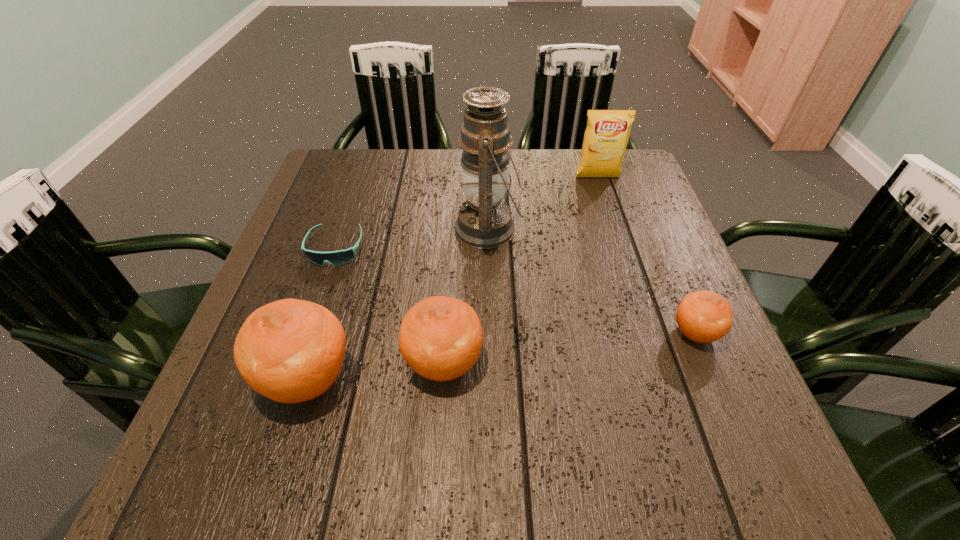
I want to click on free space between the tallest object and the shortest object, so click(412, 239).

This screenshot has width=960, height=540. Identify the location of vacant point located between the tallest object and the shortest object. (412, 239).

Find the location of a particular element. vacant area that lies between the leftmost orange and the crisp (potato chip) is located at coordinates (452, 278).

Where is `free space between the second tallest orange and the leftmost orange`? Image resolution: width=960 pixels, height=540 pixels. free space between the second tallest orange and the leftmost orange is located at coordinates (375, 371).

Locate an element on the screen. The width and height of the screenshot is (960, 540). vacant point located between the leftmost orange and the rightmost orange is located at coordinates (501, 356).

This screenshot has height=540, width=960. What are the coordinates of `free area in between the leftmost orange and the second shortest object` in the screenshot? It's located at click(501, 356).

At what (x,y) coordinates should I click in order to perform the action: click on the fourth closest object to the rightmost orange. Please return your answer as a coordinate pair (x, y). This screenshot has width=960, height=540. Looking at the image, I should click on (290, 351).

Identify the location of object that stands as the fourth closest to the crisp (potato chip). (440, 338).

Where is `the second closest orange to the shortest object`? the second closest orange to the shortest object is located at coordinates (440, 338).

Where is `orange that is the second closest to the rightmost orange`? The width and height of the screenshot is (960, 540). orange that is the second closest to the rightmost orange is located at coordinates (290, 351).